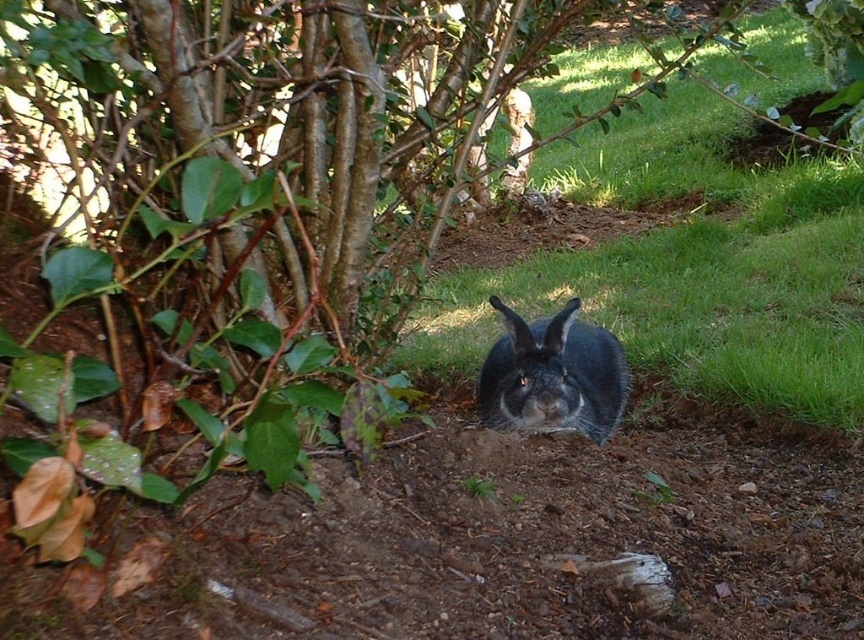
Question: Which point is farther to the camera?

Choices:
 (A) brown dirt hole at upper right
 (B) fuzzy gray rabbit at center
 (C) green grass at center

Answer: (A)

Question: Which of the following is the farthest from the observer?

Choices:
 (A) (535, 416)
 (B) (677, 115)
 (C) (837, 113)

Answer: (B)

Question: Is green grass at center thinner than fuzzy gray rabbit at center?

Choices:
 (A) no
 (B) yes

Answer: (B)

Question: Which point is closer to the camera taking this photo?

Choices:
 (A) (778, 134)
 (B) (805, 308)

Answer: (B)

Question: Does fuzzy gray rabbit at center appear on the right side of brown dirt hole at upper right?

Choices:
 (A) no
 (B) yes

Answer: (A)

Question: Can you confirm if green grass at center is wider than brown dirt hole at upper right?

Choices:
 (A) yes
 (B) no

Answer: (B)